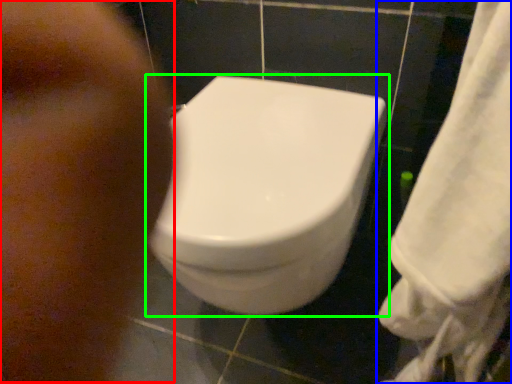
Question: Considering the real-world distances, which object is farthest from face (highlighted by a red box)? towel (highlighted by a blue box) or toilet (highlighted by a green box)?

Choices:
 (A) towel
 (B) toilet

Answer: (A)